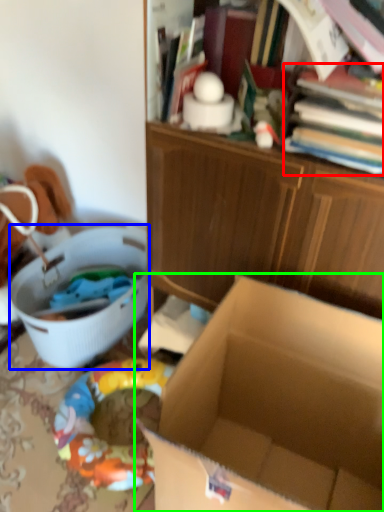
Question: Which is nearer to the book (highlighted by a red box)? laundry basket (highlighted by a blue box) or box (highlighted by a green box).

Choices:
 (A) laundry basket
 (B) box

Answer: (B)